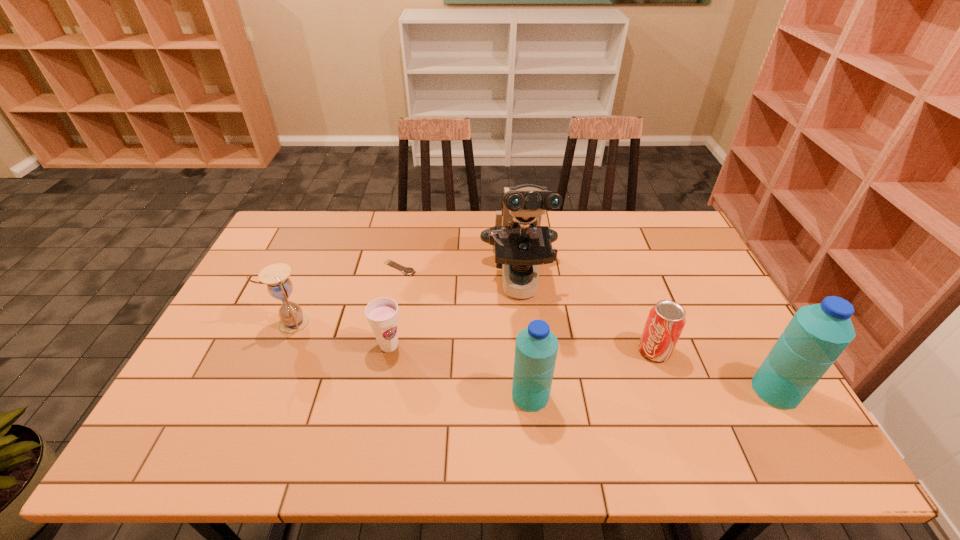
With all water bottles evenly spaced, where should an extra water bottle be placed on the left to continue the pattern? Please point out a vacant space. Please provide its 2D coordinates. Your answer should be formatted as a tuple, i.e. [(x, y)], where the tuple contains the x and y coordinates of a point satisfying the conditions above.

[(279, 401)]